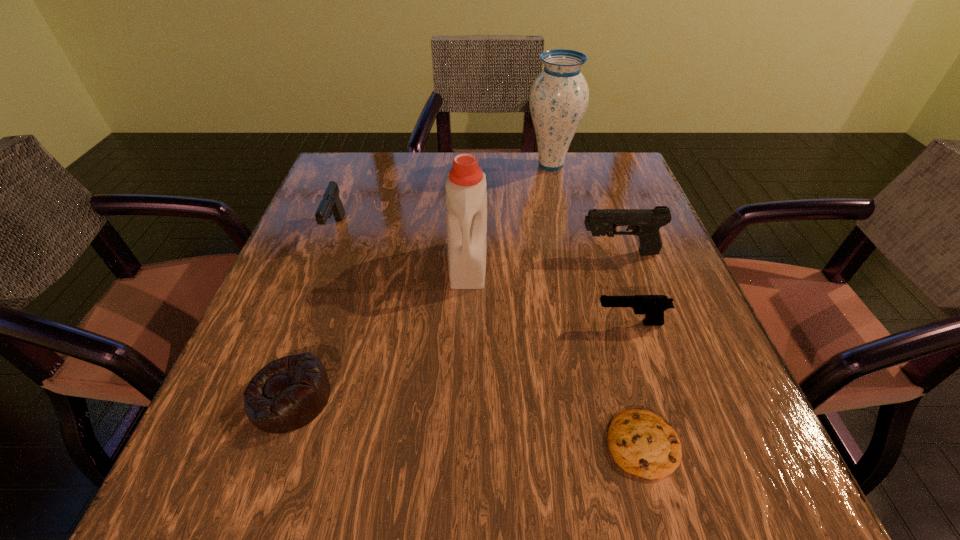
Locate an element on the screen. The width and height of the screenshot is (960, 540). free space that satisfies the following two spatial constraints: 1. aim along the barrel of the second shortest object; 2. on the right side of the fourth tallest object is located at coordinates (273, 397).

At what (x,y) coordinates should I click in order to perform the action: click on blank space that satisfies the following two spatial constraints: 1. at the barrel of the tallest pistol; 2. on the handle side of the second tallest object. Please return your answer as a coordinate pair (x, y). The image size is (960, 540). Looking at the image, I should click on point(623,264).

Locate an element on the screen. free space that satisfies the following two spatial constraints: 1. on the front-facing side of the fifth tallest object; 2. on the front side of the beanbag is located at coordinates (654, 397).

At what (x,y) coordinates should I click in order to perform the action: click on free space in the image that satisfies the following two spatial constraints: 1. at the barrel of the tallest pistol; 2. on the handle side of the second tallest object. Please return your answer as a coordinate pair (x, y). The height and width of the screenshot is (540, 960). Looking at the image, I should click on (623, 264).